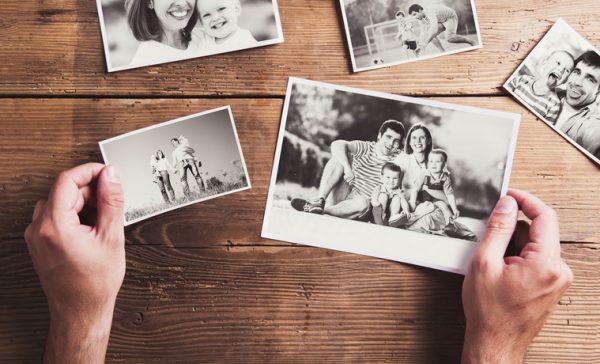
Where is `black and white photos`? black and white photos is located at coordinates (219, 25), (393, 28), (567, 56), (415, 164), (120, 152).